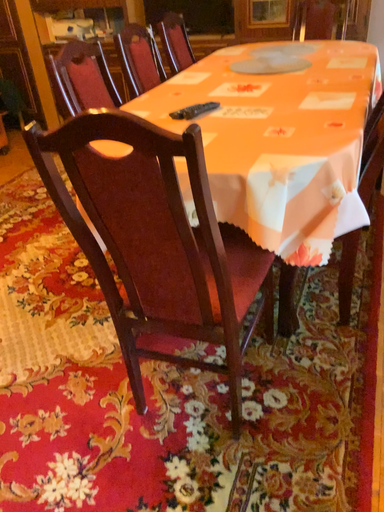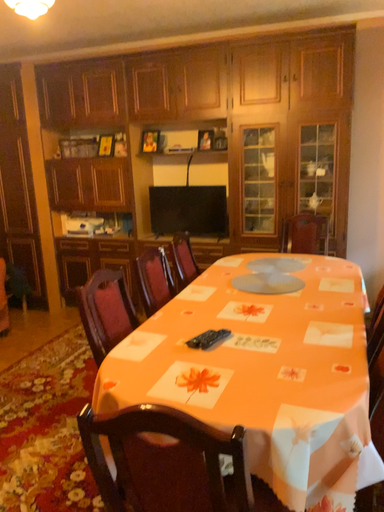
Question: Which way did the camera rotate in the video?

Choices:
 (A) rotated upward
 (B) rotated downward

Answer: (A)